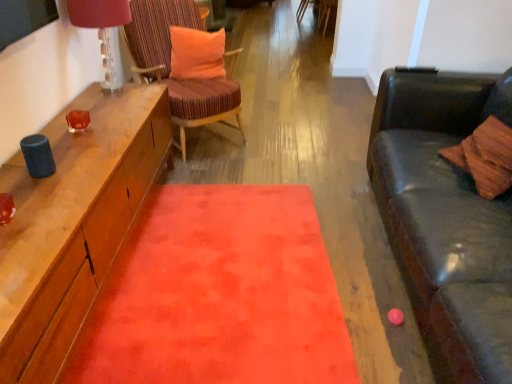
Question: Is matte glass lampshade at upper left closer to the viewer compared to striped fabric chair at center?

Choices:
 (A) yes
 (B) no

Answer: (A)

Question: Is striped fabric chair at center at the back of matte glass lampshade at upper left?

Choices:
 (A) yes
 (B) no

Answer: (B)

Question: Considering the relative sizes of matte glass lampshade at upper left and striped fabric chair at center in the image provided, is matte glass lampshade at upper left taller than striped fabric chair at center?

Choices:
 (A) yes
 (B) no

Answer: (B)

Question: Considering the relative sizes of matte glass lampshade at upper left and striped fabric chair at center in the image provided, is matte glass lampshade at upper left shorter than striped fabric chair at center?

Choices:
 (A) yes
 (B) no

Answer: (A)

Question: Can we say matte glass lampshade at upper left lies outside striped fabric chair at center?

Choices:
 (A) yes
 (B) no

Answer: (A)

Question: Are matte glass lampshade at upper left and striped fabric chair at center far apart?

Choices:
 (A) yes
 (B) no

Answer: (B)

Question: Does velvet orange rug at center have a larger size compared to matte glass lampshade at upper left?

Choices:
 (A) no
 (B) yes

Answer: (B)

Question: Can you confirm if velvet orange rug at center is smaller than matte glass lampshade at upper left?

Choices:
 (A) yes
 (B) no

Answer: (B)

Question: Is velvet orange rug at center facing towards matte glass lampshade at upper left?

Choices:
 (A) yes
 (B) no

Answer: (B)

Question: Is velvet orange rug at center completely or partially outside of matte glass lampshade at upper left?

Choices:
 (A) yes
 (B) no

Answer: (A)

Question: Is velvet orange rug at center at the right side of matte glass lampshade at upper left?

Choices:
 (A) yes
 (B) no

Answer: (A)

Question: Can you confirm if velvet orange rug at center is taller than matte glass lampshade at upper left?

Choices:
 (A) no
 (B) yes

Answer: (A)

Question: From the image's perspective, is matte glass lampshade at upper left below orange plush pillow at center?

Choices:
 (A) yes
 (B) no

Answer: (A)